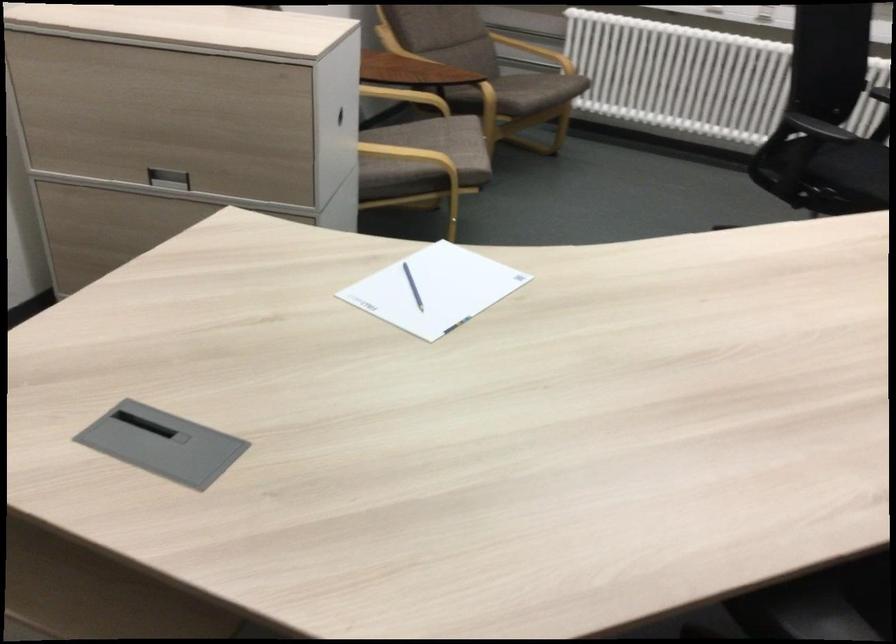
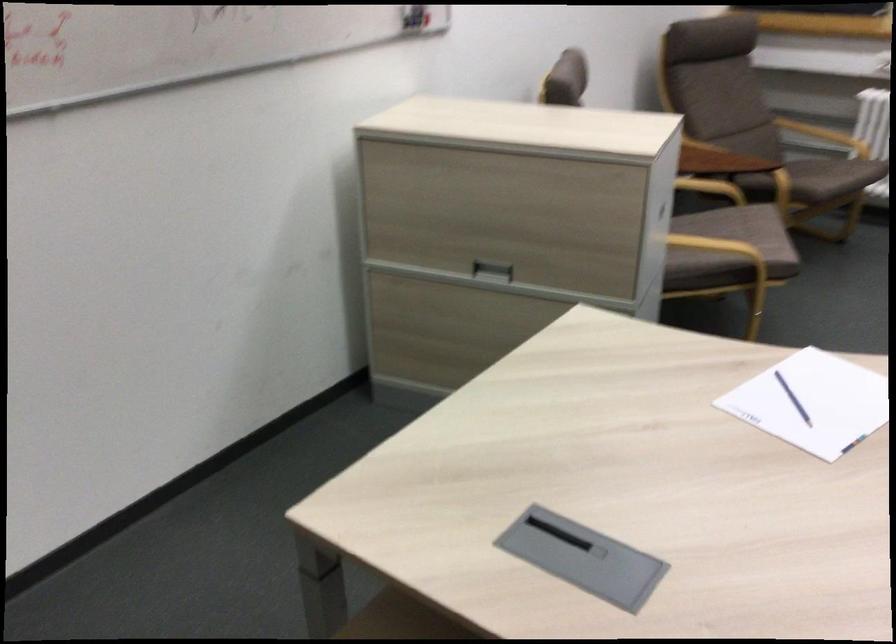
In the second image, find the point that corresponds to pixel 174 183 in the first image.

(492, 270)